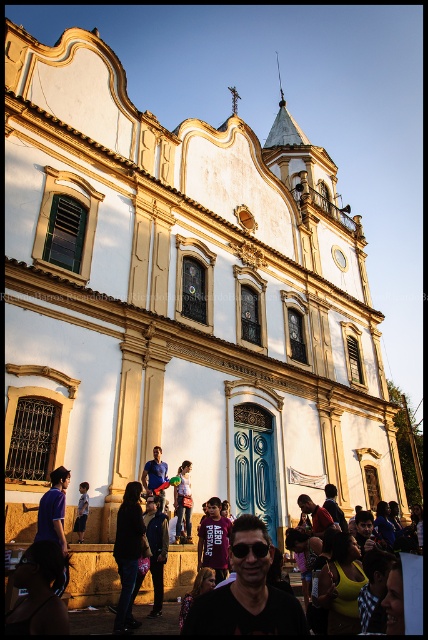
You are standing in front of the church and want to pick up both items. Which item is closer to you? The matte black sunglasses at center or the maroon jersey at center?

The matte black sunglasses at center is 12.68 meters away from the maroon jersey at center, so the maroon jersey at center is closer to you.

You are standing in front of a church and want to take a photo of the matte black sunglasses at center. If your camera can focus on objects up to 20 meters away, will it be able to capture the sunglasses clearly?

The matte black sunglasses at center are 18.85 meters away from the camera, which is within the camera focus range of up to 20 meters. Therefore, the camera can capture the sunglasses clearly.